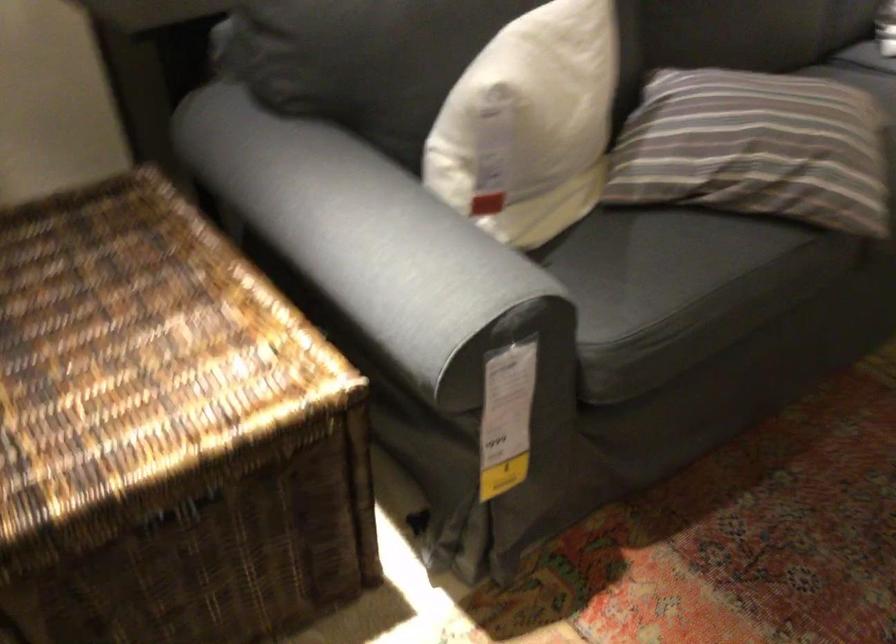
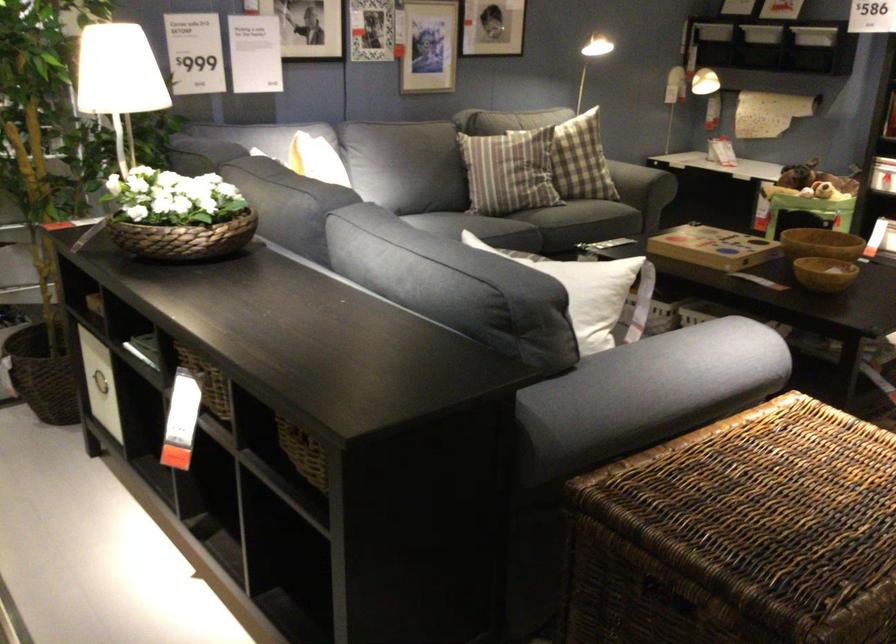
The point at [458,96] is marked in the first image. Where is the corresponding point in the second image?

(581, 272)